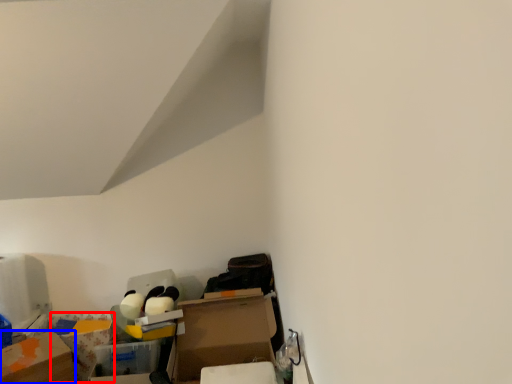
Question: Which point is closer to the camera, storage box (highlighted by a red box) or cardboard box (highlighted by a blue box)?

Choices:
 (A) storage box
 (B) cardboard box

Answer: (B)